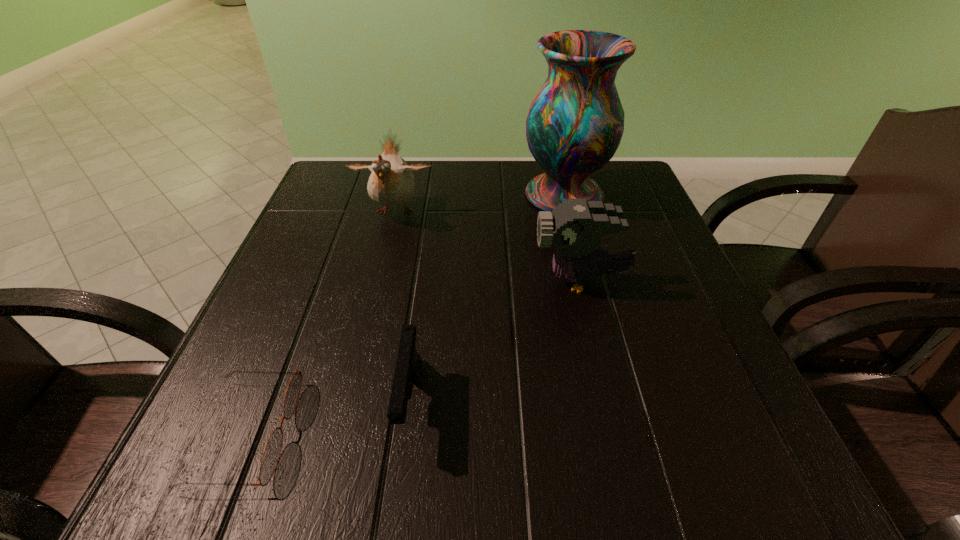
Where is `vacant area between the second shortest object and the vase`? vacant area between the second shortest object and the vase is located at coordinates (487, 299).

Find the location of a particular element. Image resolution: width=960 pixels, height=540 pixels. empty space between the left bird and the tallest object is located at coordinates (479, 204).

I want to click on free area in between the tallest object and the shortest object, so click(405, 313).

The width and height of the screenshot is (960, 540). What are the coordinates of `vacant point located between the pistol and the tallest object` in the screenshot? It's located at (487, 299).

This screenshot has width=960, height=540. Find the location of `free space that is in between the sunglasses and the farther bird`. free space that is in between the sunglasses and the farther bird is located at coordinates (321, 322).

Identify the location of unoccupied area between the pistol and the left bird. This screenshot has height=540, width=960. (402, 307).

This screenshot has height=540, width=960. In order to click on vacant space that is in between the nearer bird and the farther bird in this screenshot , I will do `click(488, 247)`.

Where is `vacant point located between the sunglasses and the second shortest object`? The image size is (960, 540). vacant point located between the sunglasses and the second shortest object is located at coordinates (328, 417).

Where is `empty location between the left bird and the fourth tallest object`? The image size is (960, 540). empty location between the left bird and the fourth tallest object is located at coordinates (402, 307).

Choose which object is the fourth nearest neighbor to the third farthest object. Please provide its 2D coordinates. Your answer should be formatted as a tuple, i.e. [(x, y)], where the tuple contains the x and y coordinates of a point satisfying the conditions above.

[(272, 451)]